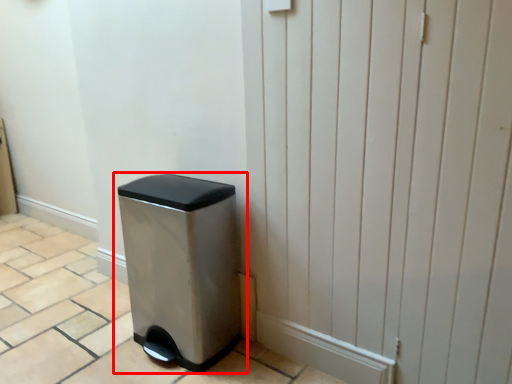
Question: From the image's perspective, where is waste container (annotated by the red box) located relative to screen door?

Choices:
 (A) below
 (B) above

Answer: (A)